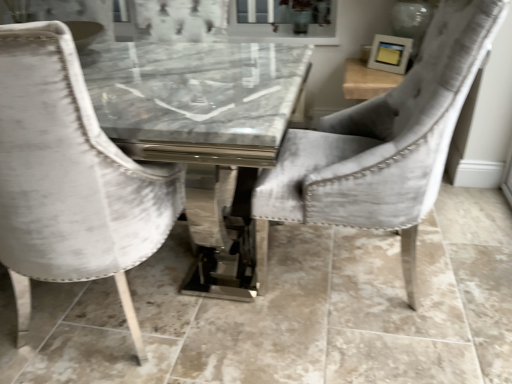
Image resolution: width=512 pixels, height=384 pixels. What are the coordinates of `free space underneath velvet gray chair at center, which is counted as the 1th chair, starting from the right (from a real-world perspective)` in the screenshot? It's located at (355, 268).